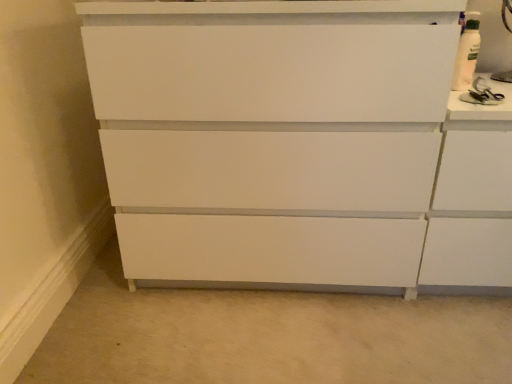
The width and height of the screenshot is (512, 384). What do you see at coordinates (298, 145) in the screenshot?
I see `white matte chest of drawers at center` at bounding box center [298, 145].

The image size is (512, 384). I want to click on white matte chest of drawers at center, so click(x=298, y=145).

In order to face white matte chest of drawers at center, should I rotate leftwards or rightwards?

Turn right approximately 1.580 degrees to face it.

Describe the element at coordinates (472, 198) in the screenshot. The width and height of the screenshot is (512, 384). I see `white textured cabinet at upper right` at that location.

Locate an element on the screen. white textured cabinet at upper right is located at coordinates (472, 198).

I want to click on white matte chest of drawers at center, so click(298, 145).

Based on the photo, which object is positioned more to the right, white textured cabinet at upper right or white matte chest of drawers at center?

white textured cabinet at upper right.

Is white textured cabinet at upper right further to the viewer compared to white matte chest of drawers at center?

Yes, white textured cabinet at upper right is behind white matte chest of drawers at center.

Which is less distant, (498, 252) or (219, 163)?

Point (498, 252) is farther from the camera than point (219, 163).

From the image's perspective, is white textured cabinet at upper right positioned above or below white matte chest of drawers at center?

white textured cabinet at upper right is situated lower than white matte chest of drawers at center in the image.

From a real-world perspective, is white textured cabinet at upper right positioned under white matte chest of drawers at center based on gravity?

Yes.

Does white textured cabinet at upper right have a lesser width compared to white matte chest of drawers at center?

Correct, the width of white textured cabinet at upper right is less than that of white matte chest of drawers at center.

Considering the sizes of white textured cabinet at upper right and white matte chest of drawers at center in the image, is white textured cabinet at upper right taller or shorter than white matte chest of drawers at center?

Clearly, white textured cabinet at upper right is shorter compared to white matte chest of drawers at center.

In terms of size, does white textured cabinet at upper right appear bigger or smaller than white matte chest of drawers at center?

In the image, white textured cabinet at upper right appears to be smaller than white matte chest of drawers at center.

Looking at this image, is white textured cabinet at upper right not inside white matte chest of drawers at center?

Yes, white textured cabinet at upper right is located beyond the bounds of white matte chest of drawers at center.

Is white textured cabinet at upper right next to white matte chest of drawers at center and touching it?

They are not placed beside each other.

Is white matte chest of drawers at center at the back of white textured cabinet at upper right?

No, white textured cabinet at upper right's orientation is not away from white matte chest of drawers at center.

What's the angular difference between white textured cabinet at upper right and white matte chest of drawers at center's facing directions?

4.98e-06 degrees separate the facing orientations of white textured cabinet at upper right and white matte chest of drawers at center.

Find the location of `the chest of drawers that is above the white textured cabinet at upper right (from the image's perspective)`. the chest of drawers that is above the white textured cabinet at upper right (from the image's perspective) is located at coordinates (298, 145).

Between white matte chest of drawers at center and white textured cabinet at upper right, which one appears on the left side from the viewer's perspective?

white matte chest of drawers at center.

Does white matte chest of drawers at center come in front of white textured cabinet at upper right?

That is True.

Does point (443, 222) come behind point (487, 246)?

No, it is not.

From the image's perspective, is white matte chest of drawers at center located above or below white textured cabinet at upper right?

Clearly, from the image's perspective, white matte chest of drawers at center is above white textured cabinet at upper right.

From a real-world perspective, which object rests below the other?

white textured cabinet at upper right is physically lower.

Does white matte chest of drawers at center have a lesser width compared to white textured cabinet at upper right?

No.

Can you confirm if white matte chest of drawers at center is shorter than white textured cabinet at upper right?

Incorrect, the height of white matte chest of drawers at center does not fall short of that of white textured cabinet at upper right.

Consider the image. In terms of size, does white matte chest of drawers at center appear bigger or smaller than white textured cabinet at upper right?

white matte chest of drawers at center is bigger than white textured cabinet at upper right.

Is white matte chest of drawers at center situated inside white textured cabinet at upper right or outside?

white matte chest of drawers at center is not inside white textured cabinet at upper right, it's outside.

Are white matte chest of drawers at center and white textured cabinet at upper right far apart?

They are positioned close to each other.

Could you tell me if white matte chest of drawers at center is turned towards white textured cabinet at upper right?

No, white matte chest of drawers at center is not oriented towards white textured cabinet at upper right.

I want to click on chest of drawers in front of the white textured cabinet at upper right, so click(x=298, y=145).

In order to click on chest of drawers in front of the white textured cabinet at upper right in this screenshot , I will do `click(298, 145)`.

Where is `cabinetry behind the white matte chest of drawers at center`? The image size is (512, 384). cabinetry behind the white matte chest of drawers at center is located at coordinates (472, 198).